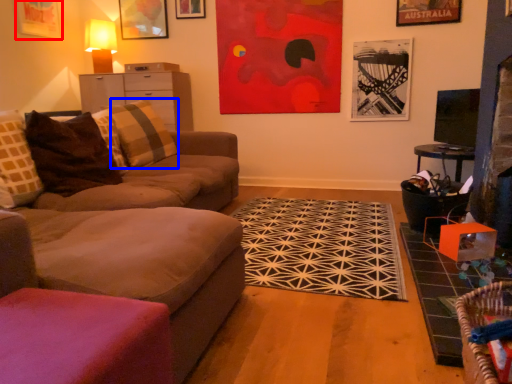
Question: Which object is closer to the camera taking this photo, picture frame (highlighted by a red box) or pillow (highlighted by a blue box)?

Choices:
 (A) picture frame
 (B) pillow

Answer: (B)